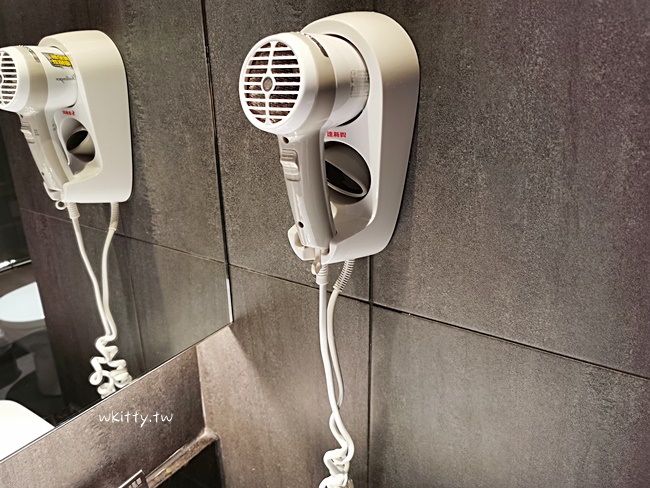
At what (x,y) coordinates should I click in order to perform the action: click on reflection of hair dryer holder. Please return your answer as a coordinate pair (x, y). Image resolution: width=650 pixels, height=488 pixels. Looking at the image, I should click on click(106, 99).